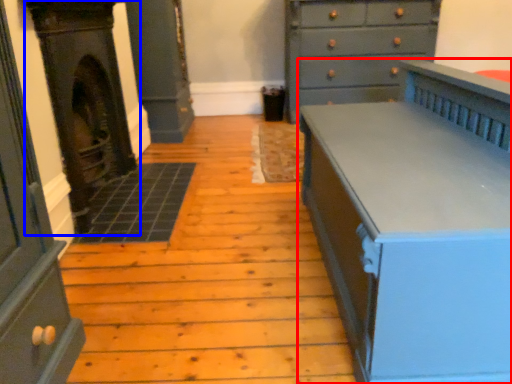
Question: Which point is further to the camera, chest of drawers (highlighted by a red box) or fireplace (highlighted by a blue box)?

Choices:
 (A) chest of drawers
 (B) fireplace

Answer: (B)